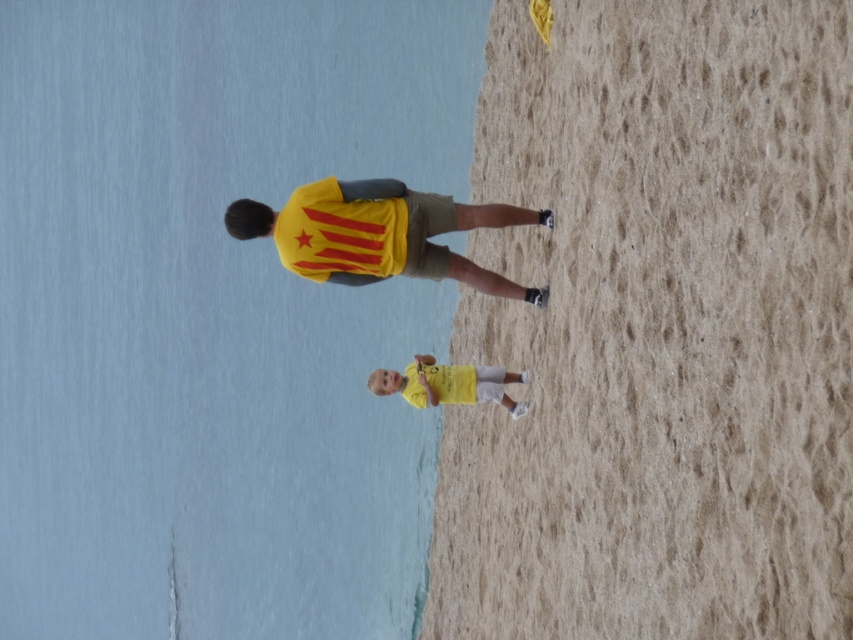
Question: Which object is positioned closest to the yellow matte shirt at center?

Choices:
 (A) fine-grained sand at lower right
 (B) yellow fabric shirt at center

Answer: (B)

Question: Is fine-grained sand at lower right to the left of yellow fabric shirt at center from the viewer's perspective?

Choices:
 (A) yes
 (B) no

Answer: (B)

Question: Is fine-grained sand at lower right below yellow matte shirt at center?

Choices:
 (A) yes
 (B) no

Answer: (B)

Question: Which object appears farthest from the camera in this image?

Choices:
 (A) yellow fabric shirt at center
 (B) fine-grained sand at lower right
 (C) yellow matte shirt at center

Answer: (C)

Question: Which point appears closest to the camera in this image?

Choices:
 (A) (700, 120)
 (B) (280, 218)
 (C) (410, 403)

Answer: (A)

Question: Does fine-grained sand at lower right have a greater width compared to yellow fabric shirt at center?

Choices:
 (A) yes
 (B) no

Answer: (B)